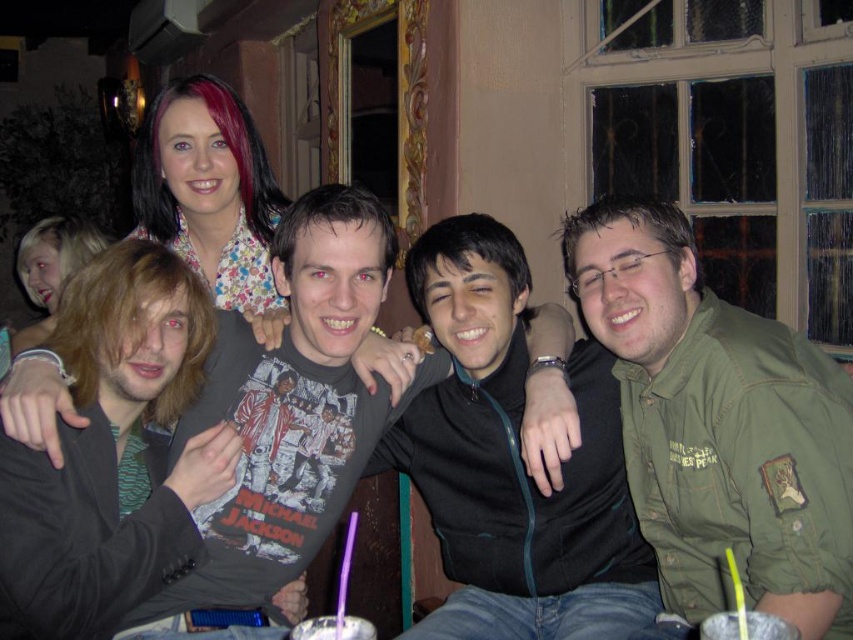
Question: Can you confirm if black matte jacket at center is smaller than dark gray t-shirt at center?

Choices:
 (A) yes
 (B) no

Answer: (B)

Question: Which object is the farthest from the translucent plastic cup at lower center?

Choices:
 (A) dark gray t-shirt at center
 (B) green matte shirt at right

Answer: (B)

Question: Which object is farther from the camera taking this photo?

Choices:
 (A) green matte shirt at right
 (B) black matte jacket at center

Answer: (B)

Question: Does green matte shirt at right have a greater width compared to yellow plastic straw at lower right?

Choices:
 (A) yes
 (B) no

Answer: (A)

Question: Which point is farther to the camera?

Choices:
 (A) (358, 461)
 (B) (689, 320)
 (C) (338, 593)
 (D) (312, 627)

Answer: (C)

Question: Does dark gray t-shirt at center appear on the left side of purple plastic straw at lower center?

Choices:
 (A) no
 (B) yes

Answer: (A)